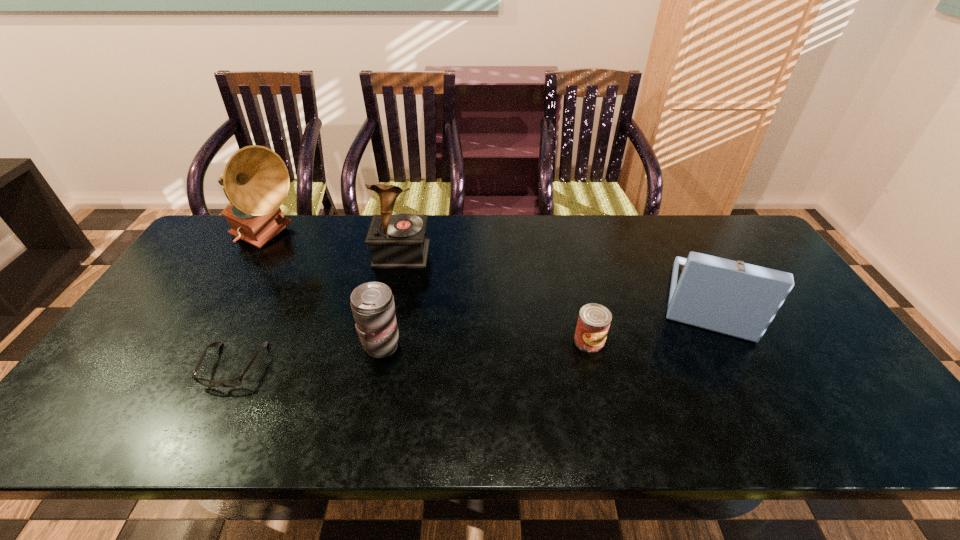
Where is `the leftmost phonograph record`? The image size is (960, 540). the leftmost phonograph record is located at coordinates (256, 181).

Locate an element on the screen. The image size is (960, 540). the tallest object is located at coordinates (256, 181).

At what (x,y) coordinates should I click in order to perform the action: click on the fifth shortest object. Please return your answer as a coordinate pair (x, y). Looking at the image, I should click on (396, 241).

At what (x,y) coordinates should I click in order to perform the action: click on the second tallest phonograph record. Please return your answer as a coordinate pair (x, y). Looking at the image, I should click on (396, 241).

The height and width of the screenshot is (540, 960). Identify the location of the rightmost phonograph record. (734, 298).

This screenshot has height=540, width=960. I want to click on the rightmost object, so click(734, 298).

The height and width of the screenshot is (540, 960). I want to click on telephoto lens, so click(x=372, y=303).

Where is `the fifth object from left to right`? This screenshot has height=540, width=960. the fifth object from left to right is located at coordinates (594, 320).

You are a GUI agent. You are given a task and a screenshot of the screen. Output one action in this format:
    pyautogui.click(x=<x>, y=<y>)
    Task: Click on the can
    Image resolution: width=960 pixels, height=540 pixels.
    Given the screenshot: What is the action you would take?
    pyautogui.click(x=594, y=320)

Where is `spectacles`? spectacles is located at coordinates (234, 381).